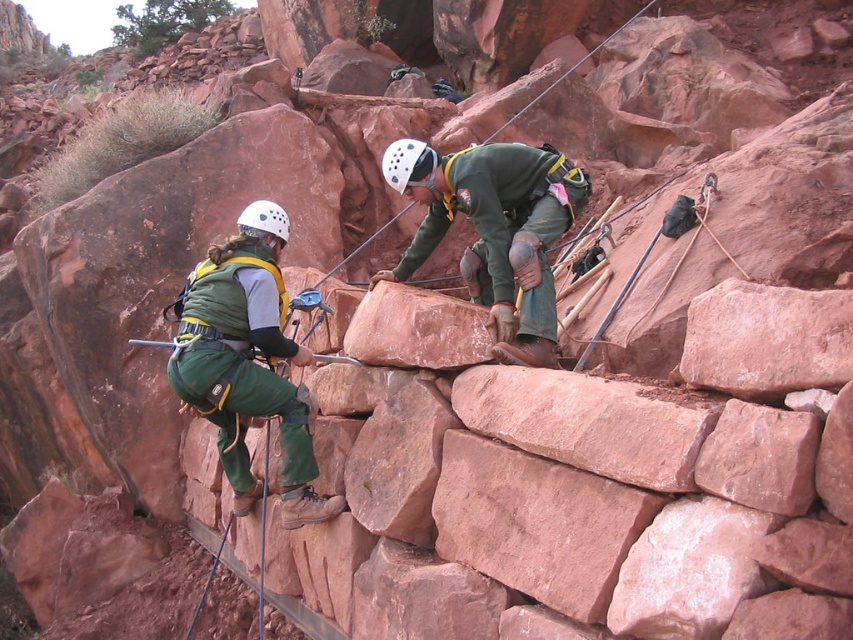
Based on the photo, is white matte helmet at upper center behind green fabric safety vest at center?

Yes, white matte helmet at upper center is behind green fabric safety vest at center.

Is white matte helmet at upper center to the left of green fabric safety vest at center from the viewer's perspective?

In fact, white matte helmet at upper center is to the right of green fabric safety vest at center.

Between point (422, 148) and point (187, 276), which one is positioned in front?

Point (422, 148)

Image resolution: width=853 pixels, height=640 pixels. I want to click on white matte helmet at upper center, so click(x=409, y=164).

Does white matte helmet at upper center have a greater height compared to white matte helmet at center?

Incorrect, white matte helmet at upper center's height is not larger of white matte helmet at center's.

Consider the image. Can you confirm if white matte helmet at upper center is positioned to the left of white matte helmet at center?

No, white matte helmet at upper center is not to the left of white matte helmet at center.

Which is in front, point (386, 177) or point (277, 218)?

Point (277, 218) is in front.

Image resolution: width=853 pixels, height=640 pixels. I want to click on white matte helmet at upper center, so click(409, 164).

Can you confirm if green fabric safety vest at center is wider than white matte helmet at center?

Yes.

Which is in front, point (227, 257) or point (263, 216)?

Point (227, 257) is more forward.

Where is `green fabric safety vest at center`? This screenshot has height=640, width=853. green fabric safety vest at center is located at coordinates (213, 269).